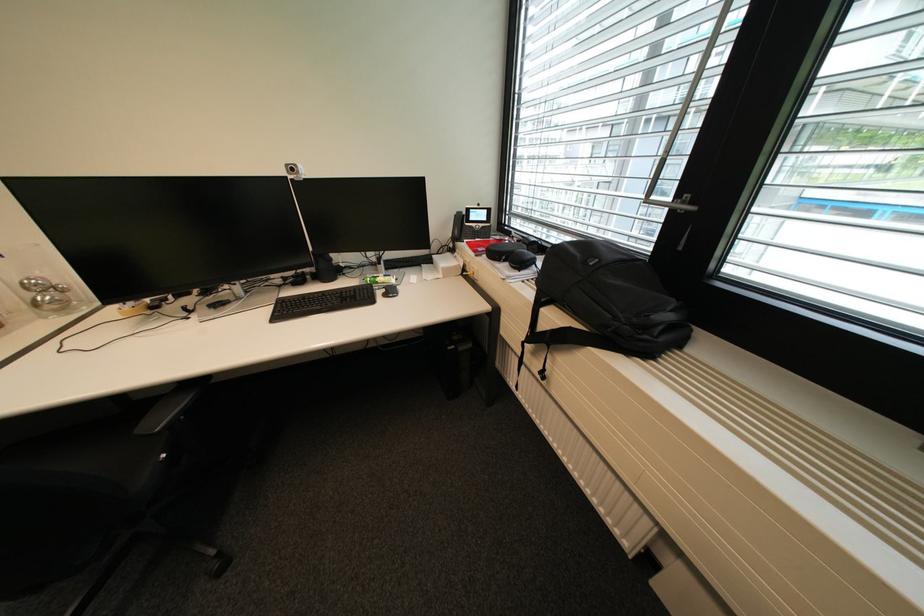
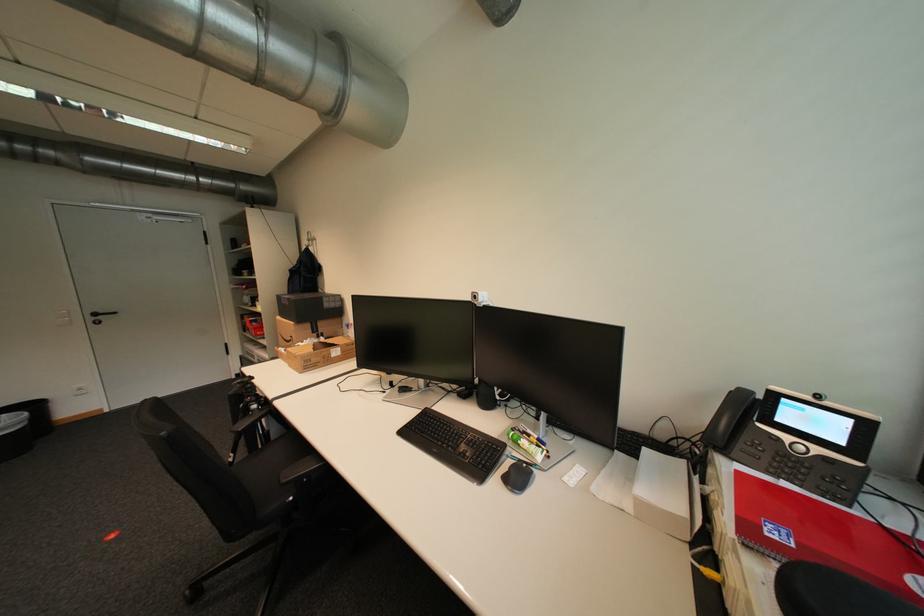
Locate, in the second image, the point that corresponds to [484,256] in the first image.

(754, 545)